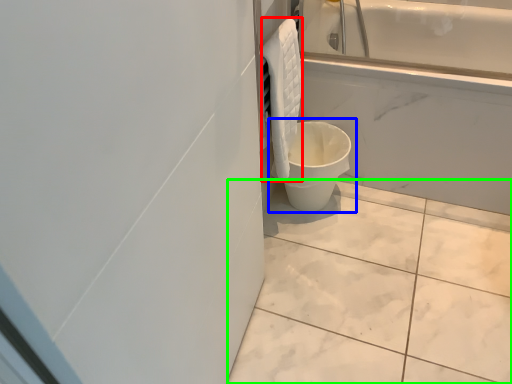
Question: Based on their relative distances, which object is farther from material (highlighted by a red box)? Choose from toilet (highlighted by a blue box) and ceramic tile (highlighted by a green box).

Choices:
 (A) toilet
 (B) ceramic tile

Answer: (B)